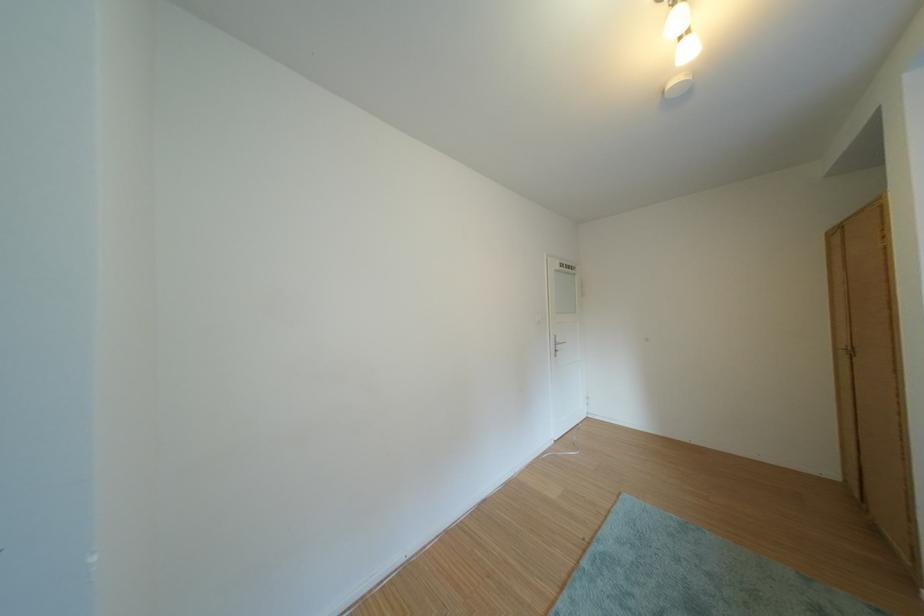
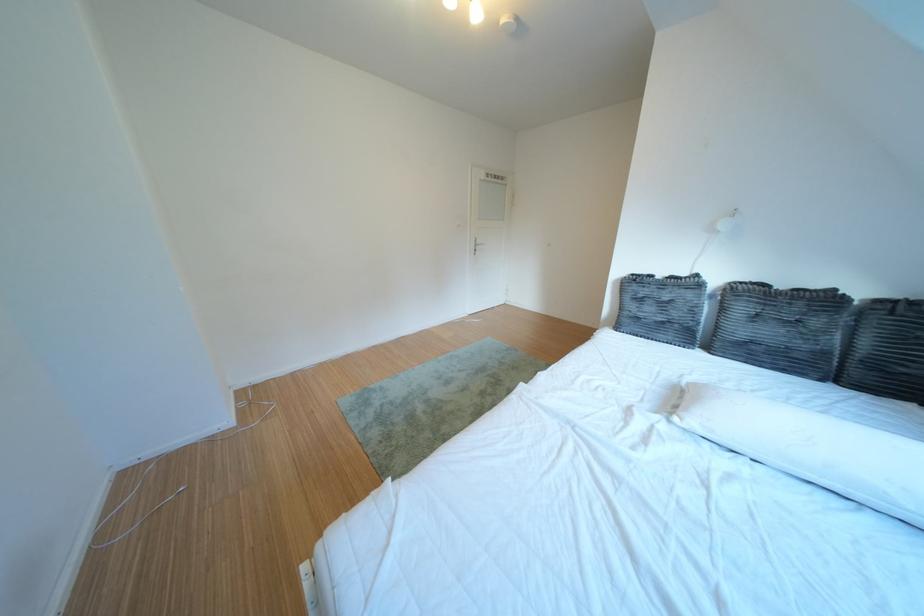
What movement of the cameraman would produce the second image?

The movement direction of the cameraman is right, backward.